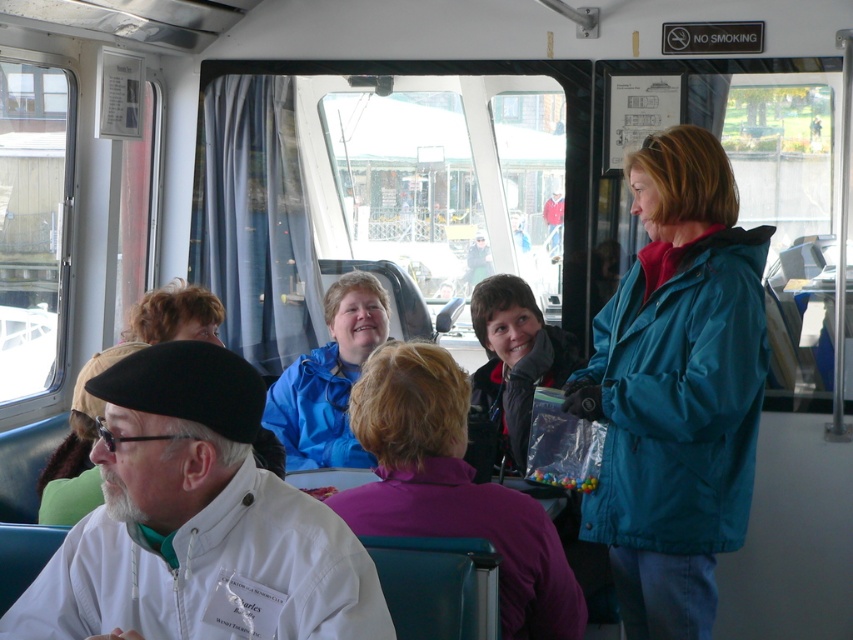
Question: Does white matte coat at lower left appear on the left side of blue matte jacket at center?

Choices:
 (A) no
 (B) yes

Answer: (A)

Question: Estimate the real-world distances between objects in this image. Which object is closer to the matte blue jacket at center?

Choices:
 (A) white matte coat at lower left
 (B) blue matte jacket at center

Answer: (B)

Question: Does teal fabric jacket at right have a larger size compared to blue matte jacket at center?

Choices:
 (A) no
 (B) yes

Answer: (B)

Question: Estimate the real-world distances between objects in this image. Which object is farther from the white matte coat at lower left?

Choices:
 (A) blue matte jacket at center
 (B) matte blue jacket at center
 (C) teal fabric jacket at right

Answer: (B)

Question: Which object appears closest to the camera in this image?

Choices:
 (A) white matte coat at lower left
 (B) purple fleece jacket at center
 (C) matte blue jacket at center
 (D) teal fabric jacket at right

Answer: (A)

Question: Observing the image, what is the correct spatial positioning of teal fabric jacket at right in reference to matte blue jacket at center?

Choices:
 (A) below
 (B) above

Answer: (A)